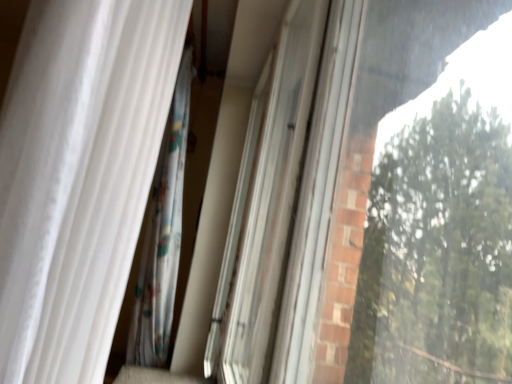
The image size is (512, 384). Identify the location of white glossy screen door at center. (266, 204).

What is the approximate width of white glossy screen door at center?

The width of white glossy screen door at center is 5.07 inches.

The height and width of the screenshot is (384, 512). Describe the element at coordinates (266, 204) in the screenshot. I see `white glossy screen door at center` at that location.

What are the coordinates of `white sheer curtain at left` in the screenshot? It's located at (78, 176).

Image resolution: width=512 pixels, height=384 pixels. What do you see at coordinates (78, 176) in the screenshot?
I see `white sheer curtain at left` at bounding box center [78, 176].

What is the approximate width of white sheer curtain at left?

The width of white sheer curtain at left is 21.46 centimeters.

In order to click on white glossy screen door at center in this screenshot , I will do `click(266, 204)`.

Between white glossy screen door at center and white sheer curtain at left, which one appears on the left side from the viewer's perspective?

white sheer curtain at left.

Is the depth of white glossy screen door at center less than that of white sheer curtain at left?

No, the depth of white glossy screen door at center is greater than that of white sheer curtain at left.

Is point (219, 328) farther from viewer compared to point (57, 147)?

Yes.

From the image's perspective, is white glossy screen door at center above or below white sheer curtain at left?

From the image's perspective, white glossy screen door at center appears below white sheer curtain at left.

From a real-world perspective, which object rests below the other?

white glossy screen door at center is physically lower.

Is white glossy screen door at center wider than white sheer curtain at left?

No, white glossy screen door at center is not wider than white sheer curtain at left.

From their relative heights in the image, would you say white glossy screen door at center is taller or shorter than white sheer curtain at left?

Considering their sizes, white glossy screen door at center has more height than white sheer curtain at left.

Is white glossy screen door at center smaller than white sheer curtain at left?

Yes.

Is white glossy screen door at center not inside white sheer curtain at left?

white glossy screen door at center lies outside white sheer curtain at left's area.

Is white glossy screen door at center directly adjacent to white sheer curtain at left?

No, white glossy screen door at center is not beside white sheer curtain at left.

Does white glossy screen door at center turn towards white sheer curtain at left?

No, white glossy screen door at center does not turn towards white sheer curtain at left.

Locate an element on the screen. screen door behind the white sheer curtain at left is located at coordinates (266, 204).

Is white sheer curtain at left to the left of white glossy screen door at center from the viewer's perspective?

Correct, you'll find white sheer curtain at left to the left of white glossy screen door at center.

Which object is closer to the camera taking this photo, white sheer curtain at left or white glossy screen door at center?

white sheer curtain at left is more forward.

Which is behind, point (25, 341) or point (251, 329)?

The point (251, 329) is farther from the camera.

From the image's perspective, which one is positioned higher, white sheer curtain at left or white glossy screen door at center?

white sheer curtain at left appears higher in the image.

From a real-world perspective, is white sheer curtain at left beneath white glossy screen door at center?

Actually, white sheer curtain at left is physically above white glossy screen door at center in the real world.

Does white sheer curtain at left have a greater width compared to white glossy screen door at center?

Yes, white sheer curtain at left is wider than white glossy screen door at center.

Considering the sizes of objects white sheer curtain at left and white glossy screen door at center in the image provided, who is shorter, white sheer curtain at left or white glossy screen door at center?

white sheer curtain at left is shorter.

Based on the photo, does white sheer curtain at left have a smaller size compared to white glossy screen door at center?

No, white sheer curtain at left is not smaller than white glossy screen door at center.

Is white sheer curtain at left spatially inside white glossy screen door at center, or outside of it?

white sheer curtain at left is not enclosed by white glossy screen door at center.

From the picture: Is white sheer curtain at left beside white glossy screen door at center?

No, white sheer curtain at left is not touching white glossy screen door at center.

In the scene shown: Could you tell me if white sheer curtain at left is facing white glossy screen door at center?

No, white sheer curtain at left is not turned towards white glossy screen door at center.

Find the location of a particular element. Image resolution: width=512 pixels, height=384 pixels. curtain on the left of white glossy screen door at center is located at coordinates (78, 176).

In order to click on curtain that is above the white glossy screen door at center (from the image's perspective) in this screenshot , I will do `click(78, 176)`.

The height and width of the screenshot is (384, 512). Find the location of `curtain on the left side of white glossy screen door at center`. curtain on the left side of white glossy screen door at center is located at coordinates [78, 176].